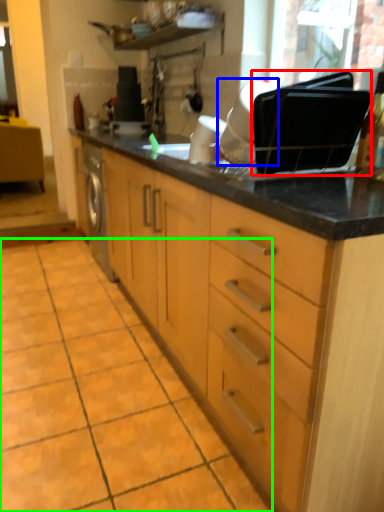
Question: Which object is positioned farthest from appliance (highlighted by a red box)? Select from appliance (highlighted by a blue box) and ceramic tile (highlighted by a green box).

Choices:
 (A) appliance
 (B) ceramic tile

Answer: (B)